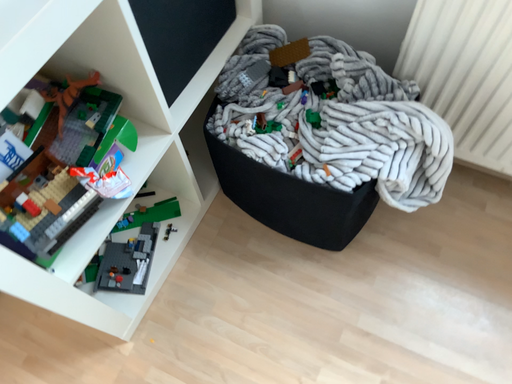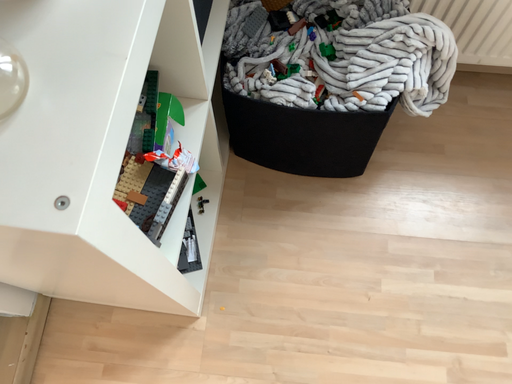
Question: Which way did the camera rotate in the video?

Choices:
 (A) rotated right
 (B) rotated left

Answer: (A)